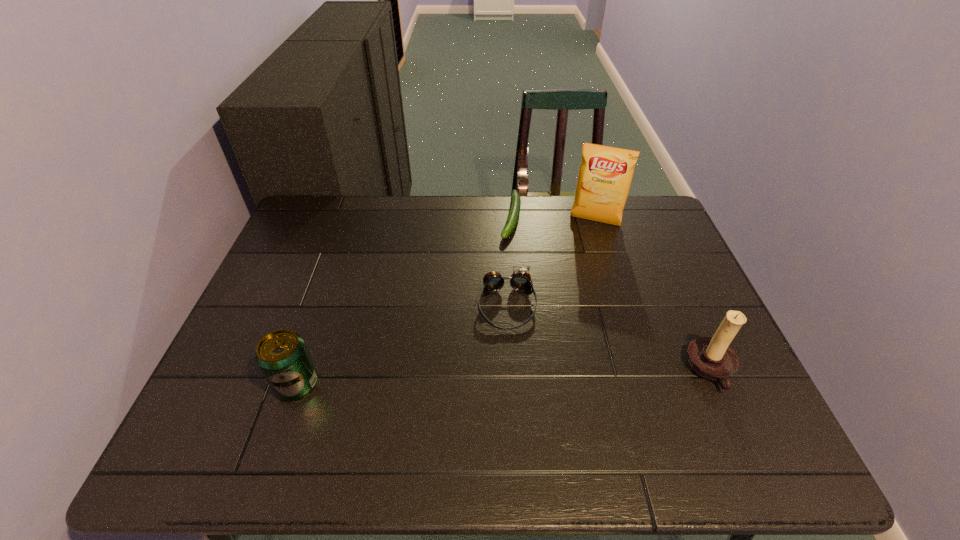
Locate an element on the screen. The width and height of the screenshot is (960, 540). vacant space on the desktop that is between the leftmost object and the candle holder and is positioned through the lenses of the goggles is located at coordinates (514, 377).

The width and height of the screenshot is (960, 540). Find the location of `free space on the desktop that is between the third tallest object and the candle holder and is positioned on the front-facing side of the shortest object`. free space on the desktop that is between the third tallest object and the candle holder and is positioned on the front-facing side of the shortest object is located at coordinates (469, 379).

The height and width of the screenshot is (540, 960). What are the coordinates of `free space on the desktop that is between the beer can and the candle holder and is positioned on the front of the crisp (potato chip) with the logo` in the screenshot? It's located at (550, 376).